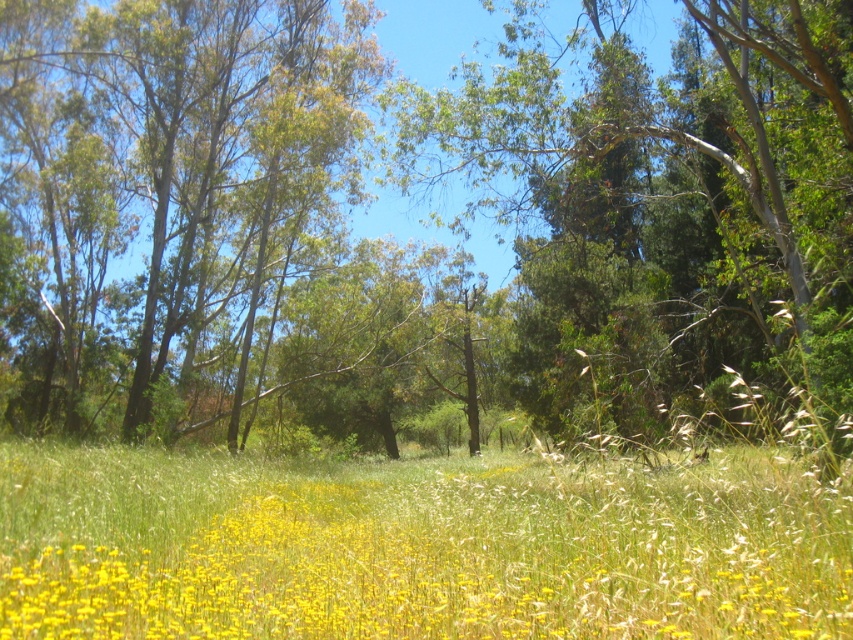
You are standing in the middle of the field of tall grasses and yellow wildflowers in the foreground. You see a point marked at coordinates [410,192]. What is located at that point?

The point at [410,192] corresponds to the green leafy tree at center.

You are standing in the middle of the field and want to walk towards the yellow grass at lower center. Which direction should you walk to avoid the green leafy tree at center?

Since the green leafy tree at center is to the left of the yellow grass at lower center, you should walk to the right to avoid the tree and reach the yellow grass at lower center.